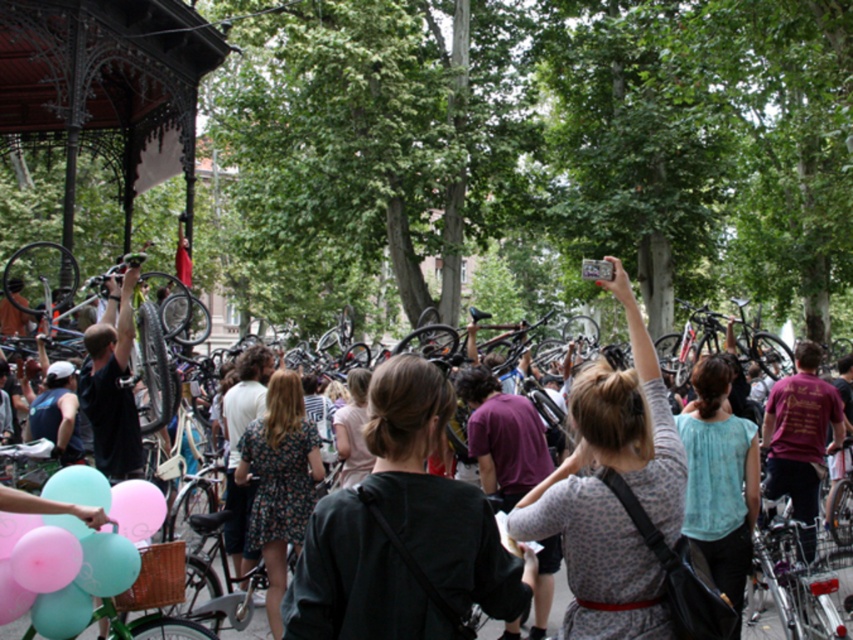
Question: Which point appears farthest from the camera in this image?

Choices:
 (A) (706, 484)
 (B) (808, 362)
 (C) (427, 451)

Answer: (B)

Question: Can you confirm if light blue sheer blouse at center is bigger than matte black t-shirt at center?

Choices:
 (A) no
 (B) yes

Answer: (B)

Question: Does patterned fabric dress at center appear on the right side of light blue sheer blouse at center?

Choices:
 (A) yes
 (B) no

Answer: (B)

Question: Can you confirm if dark green sweater at center is smaller than patterned fabric dress at center?

Choices:
 (A) yes
 (B) no

Answer: (A)

Question: Among these points, which one is farthest from the camera?

Choices:
 (A) (105, 384)
 (B) (798, 465)

Answer: (B)

Question: Which of these objects is positioned closest to the shiny silver bicycle at center?

Choices:
 (A) maroon cotton t-shirt at center
 (B) patterned fabric dress at center

Answer: (A)